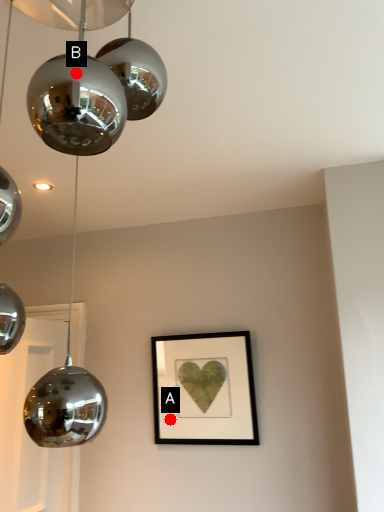
Question: Two points are circled on the image, labeled by A and B beside each circle. Which point appears farthest from the camera in this image?

Choices:
 (A) A is further
 (B) B is further

Answer: (A)